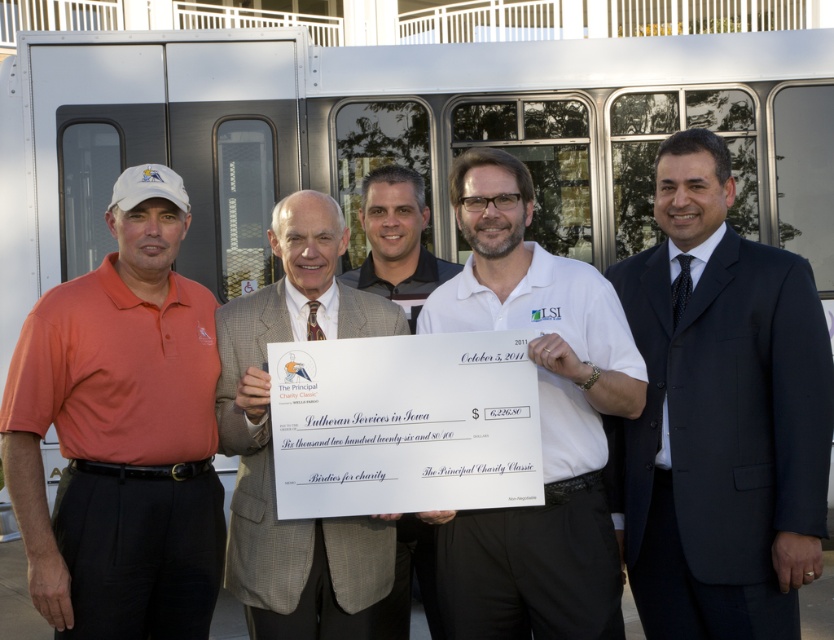
Which is behind, point (136, 584) or point (410, 243)?

Point (410, 243)

Is orange matte shirt at left to the left of white shirt at center from the viewer's perspective?

Correct, you'll find orange matte shirt at left to the left of white shirt at center.

Image resolution: width=834 pixels, height=640 pixels. Identify the location of orange matte shirt at left. (121, 433).

Is point (590, 369) closer to camera compared to point (309, 236)?

That is True.

Is white cotton shirt at center wider than white paper check at center?

Yes, white cotton shirt at center is wider than white paper check at center.

Is point (556, 532) in front of point (390, 556)?

Yes, point (556, 532) is in front of point (390, 556).

This screenshot has height=640, width=834. In order to click on white cotton shirt at center in this screenshot , I will do coord(540,420).

Does orange matte shirt at left have a greater height compared to white cotton shirt at center?

Correct, orange matte shirt at left is much taller as white cotton shirt at center.

Consider the image. Is orange matte shirt at left thinner than white cotton shirt at center?

Indeed, orange matte shirt at left has a lesser width compared to white cotton shirt at center.

Locate an element on the screen. orange matte shirt at left is located at coordinates (121, 433).